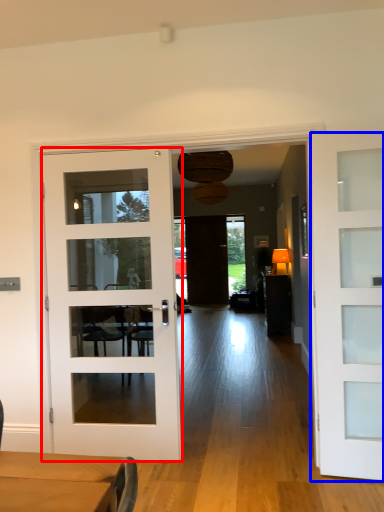
Question: Which point is further to the camera, door (highlighted by a red box) or door (highlighted by a blue box)?

Choices:
 (A) door
 (B) door

Answer: (A)